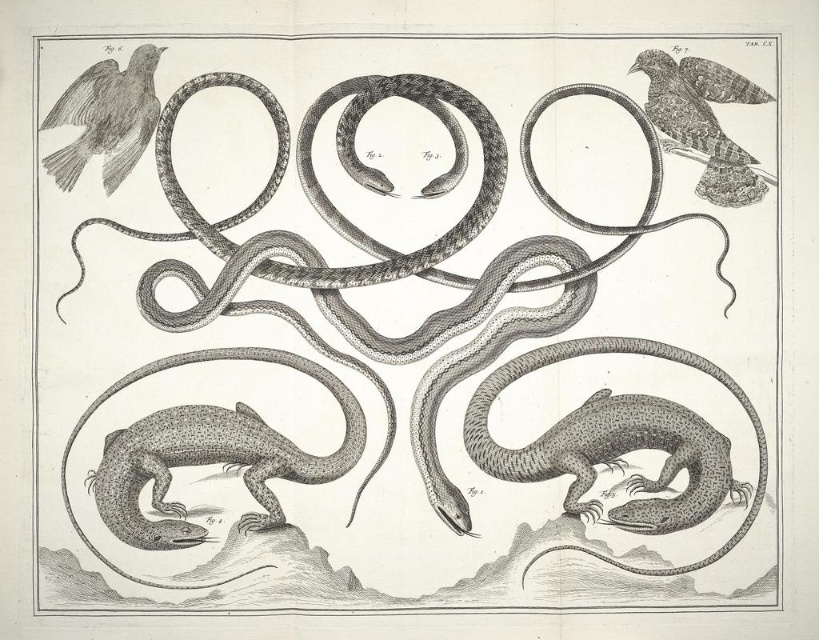
You are an entomologist examining this illustration. You need to determine the spatial relationship between the speckled textured lizard at center and the smooth feathered bird at upper right. Which one is closer to the viewer?

The speckled textured lizard at center is closer to the viewer because it is in front of the smooth feathered bird at upper right.

You are an entomologist examining the illustration. You need to identify the speckled textured lizard at center and the speckled textured lizard at lower left. Which one is closer to the viewer?

A: The speckled textured lizard at center is closer to the viewer because the speckled textured lizard at lower left is behind it.